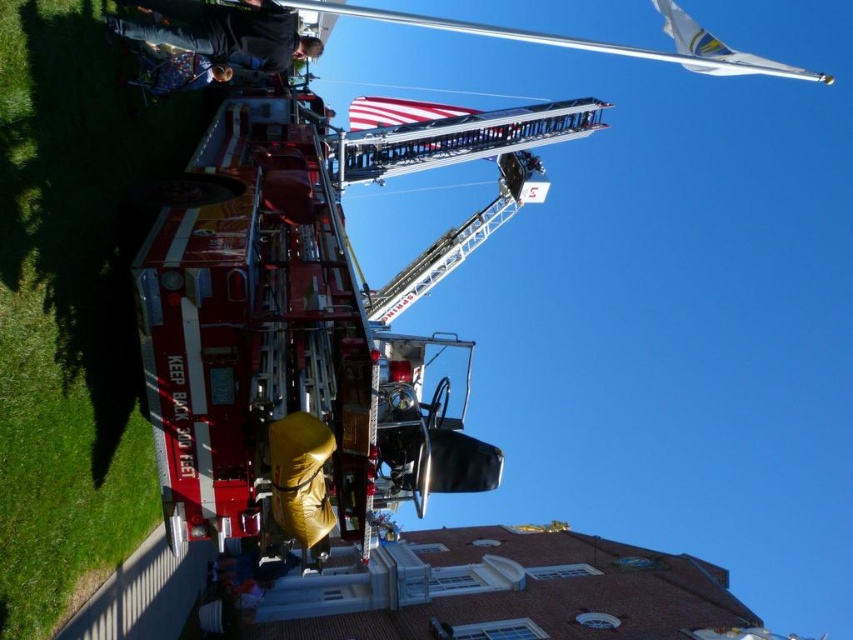
Question: Which object is the farthest from the dark gray fabric jacket at upper left?

Choices:
 (A) red metallic fire truck at center
 (B) american flag at center

Answer: (B)

Question: Can you confirm if dark gray fabric jacket at upper left is smaller than blue denim jacket at upper left?

Choices:
 (A) yes
 (B) no

Answer: (B)

Question: Which point appears closest to the camera in this image?

Choices:
 (A) (117, 22)
 (B) (227, 193)
 (C) (430, 125)

Answer: (A)

Question: Can you confirm if red metallic fire truck at center is wider than dark gray fabric jacket at upper left?

Choices:
 (A) no
 (B) yes

Answer: (B)

Question: From the image, what is the correct spatial relationship of red metallic fire truck at center in relation to blue denim jacket at upper left?

Choices:
 (A) left
 (B) right

Answer: (B)

Question: Among these points, which one is farthest from the camera?

Choices:
 (A) (317, 145)
 (B) (494, 138)
 (C) (200, 61)
 (D) (207, 51)

Answer: (B)